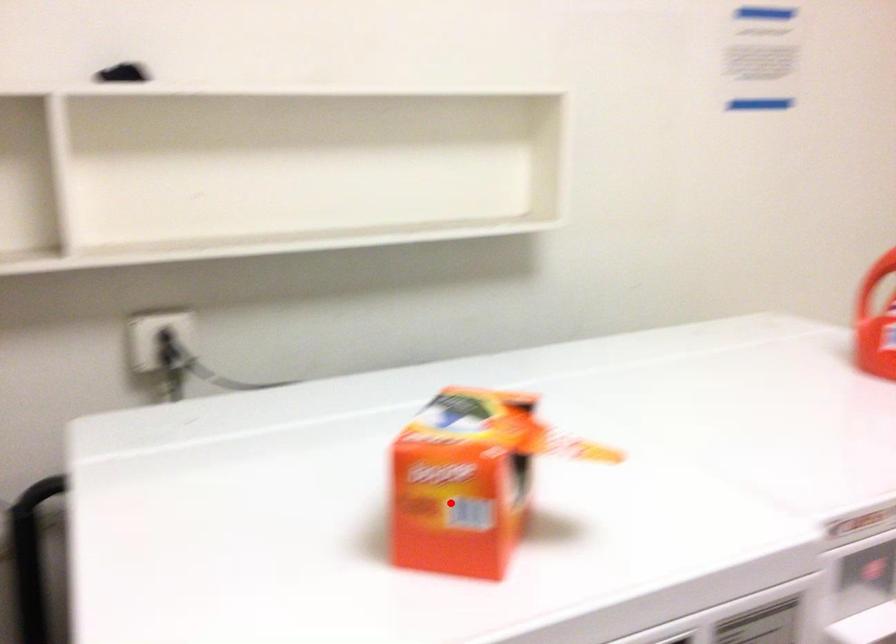
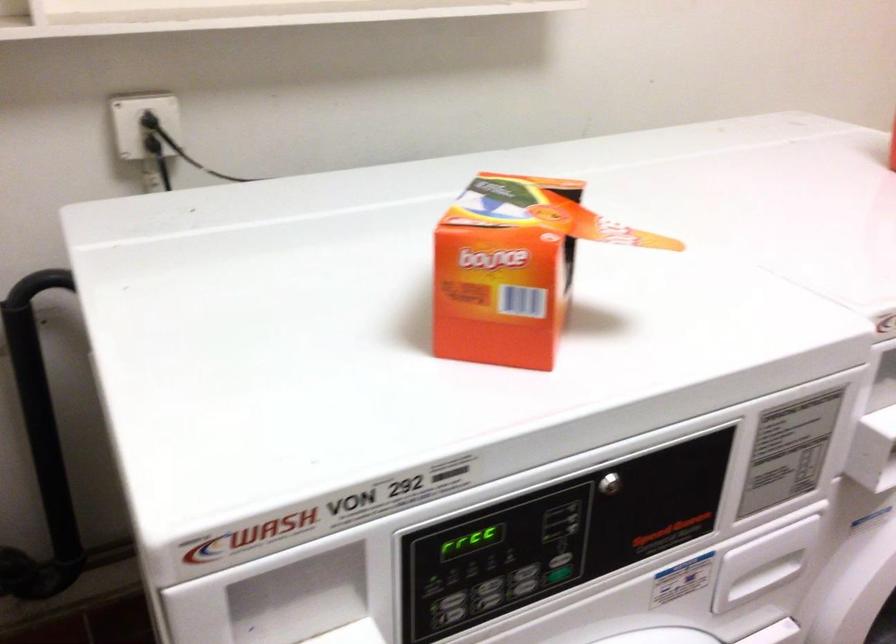
Question: I am providing you with two images of the same scene from different viewpoints. A red point is marked on the first image. Is the red point's position out of view in image 2?

Choices:
 (A) Yes
 (B) No

Answer: (B)